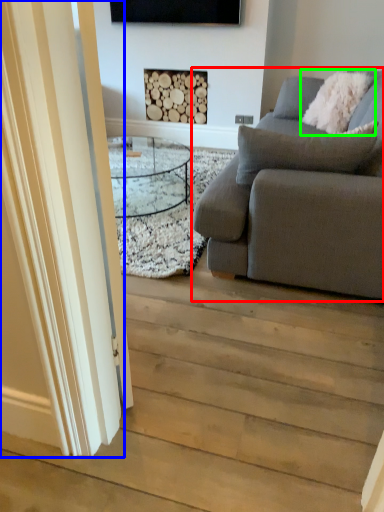
Question: Based on their relative distances, which object is nearer to studio couch (highlighted by a red box)? Choose from glass door (highlighted by a blue box) and pillow (highlighted by a green box).

Choices:
 (A) glass door
 (B) pillow

Answer: (A)